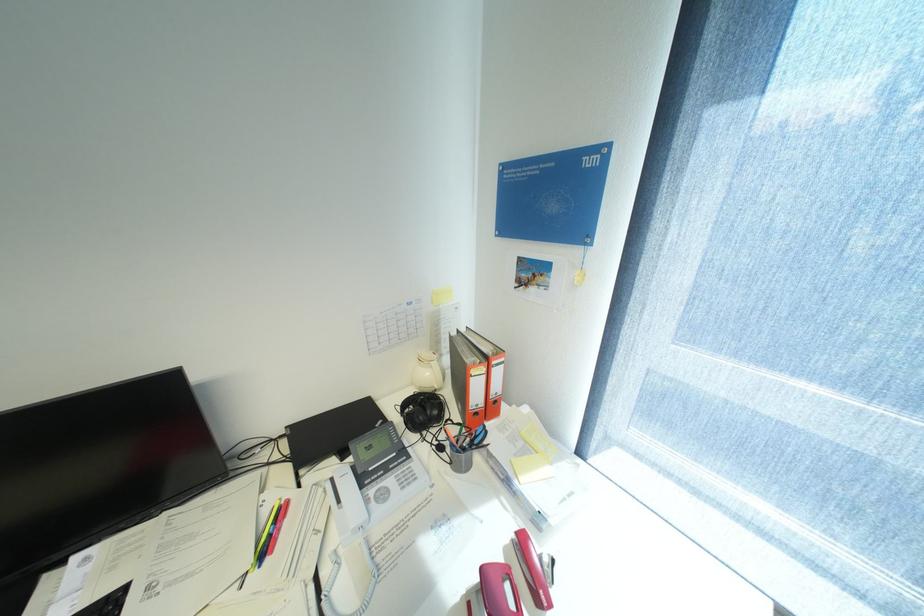
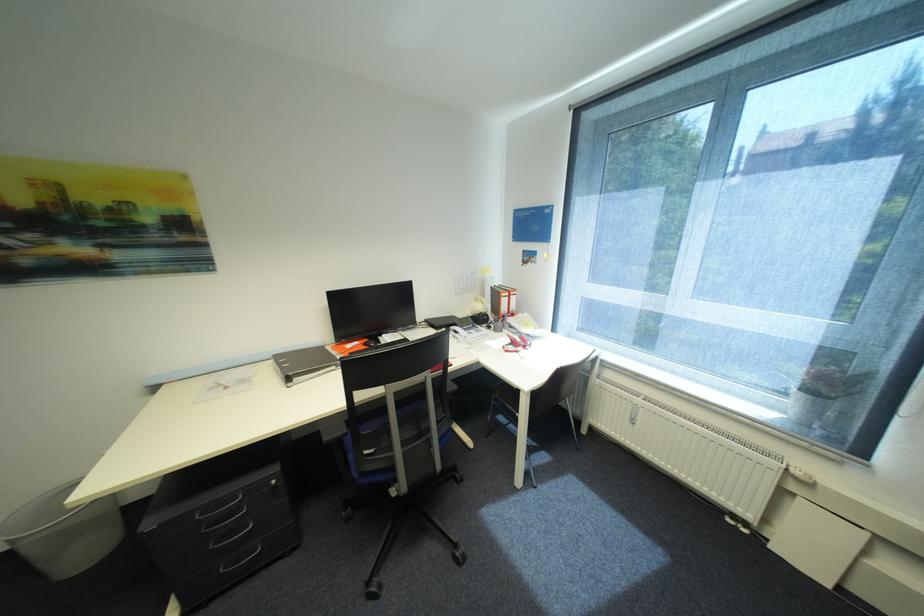
The point at (541,290) is marked in the first image. Where is the corresponding point in the second image?

(537, 265)